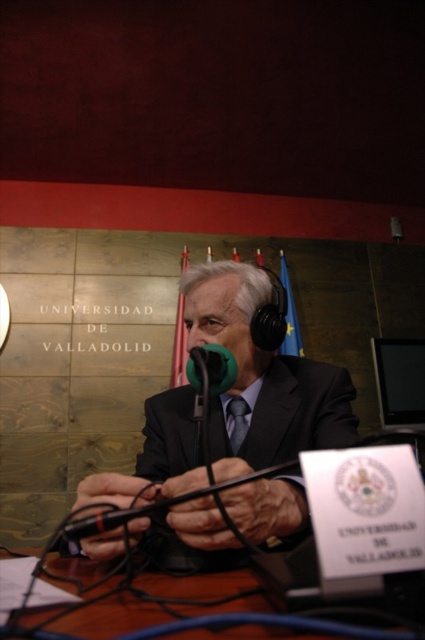
Looking at this image, can you confirm if wooden table at center is positioned above green matte microphone at center?

Incorrect, wooden table at center is not positioned above green matte microphone at center.

Is wooden table at center taller than green matte microphone at center?

Indeed, wooden table at center has a greater height compared to green matte microphone at center.

The height and width of the screenshot is (640, 425). Find the location of `wooden table at center`. wooden table at center is located at coordinates (110, 618).

Is matte black suit at center thinner than wooden table at center?

No.

Is point (209, 429) more distant than point (90, 572)?

Yes, it is.

Locate an element on the screen. matte black suit at center is located at coordinates (263, 374).

Does point (340, 371) come closer to viewer compared to point (215, 387)?

No, it is not.

Can you confirm if matte black suit at center is smaller than green matte microphone at center?

Actually, matte black suit at center might be larger than green matte microphone at center.

The width and height of the screenshot is (425, 640). Find the location of `matte black suit at center`. matte black suit at center is located at coordinates (263, 374).

Find the location of a particular element. This screenshot has height=640, width=425. matte black suit at center is located at coordinates (263, 374).